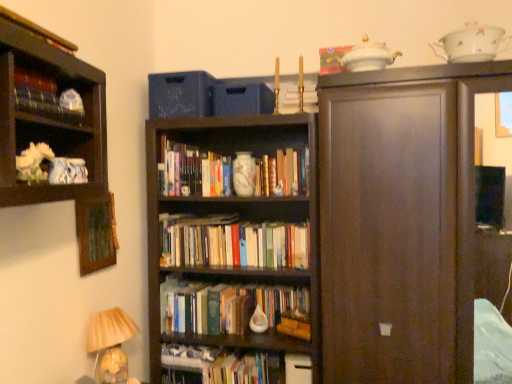
Question: From the image's perspective, relative to hardcover book at center, is gold metallic candlestick at upper center, which is the first book from right to left, above or below?

Choices:
 (A) above
 (B) below

Answer: (A)

Question: Considering their positions, is gold metallic candlestick at upper center, the 2th book in the back-to-front sequence, located in front of or behind hardcover book at center?

Choices:
 (A) front
 (B) behind

Answer: (A)

Question: Which object is positioned closest to the blue textured baskets at upper center?

Choices:
 (A) wooden picture frame at upper left
 (B) matte black book at upper left, the fourth book when ordered from right to left
 (C) hardcover book at center
 (D) translucent glass lampshade at lower left
 (E) hardcover books at center, the 1th book in the back-to-front sequence

Answer: (E)

Question: Which of these objects is positioned farthest from the hardcover books at center, the 3th book in the top-to-bottom sequence?

Choices:
 (A) matte black book at upper left, the 4th book from the back
 (B) dark wood cupboard at right
 (C) hardcover book at center
 (D) translucent glass lampshade at lower left
 (E) wooden picture frame at upper left

Answer: (C)